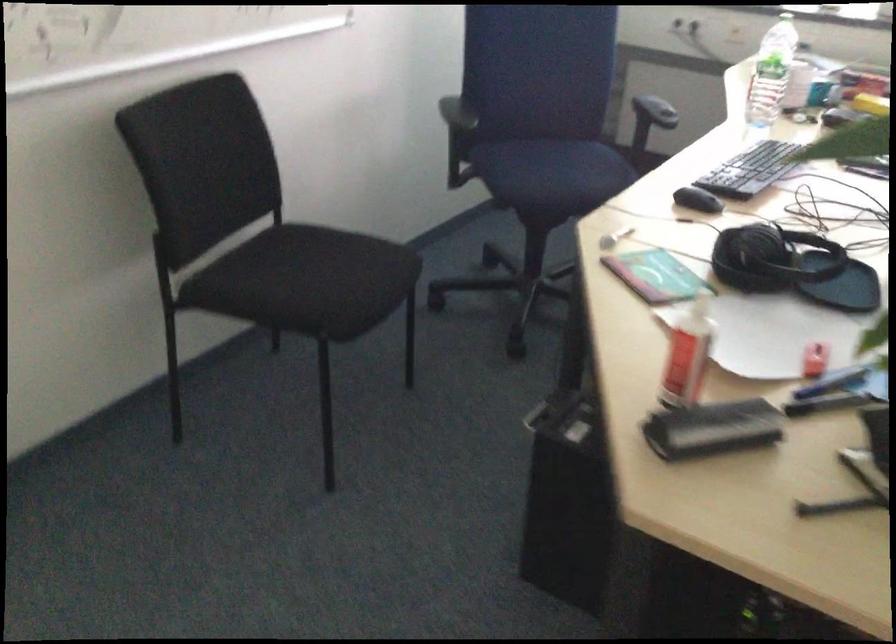
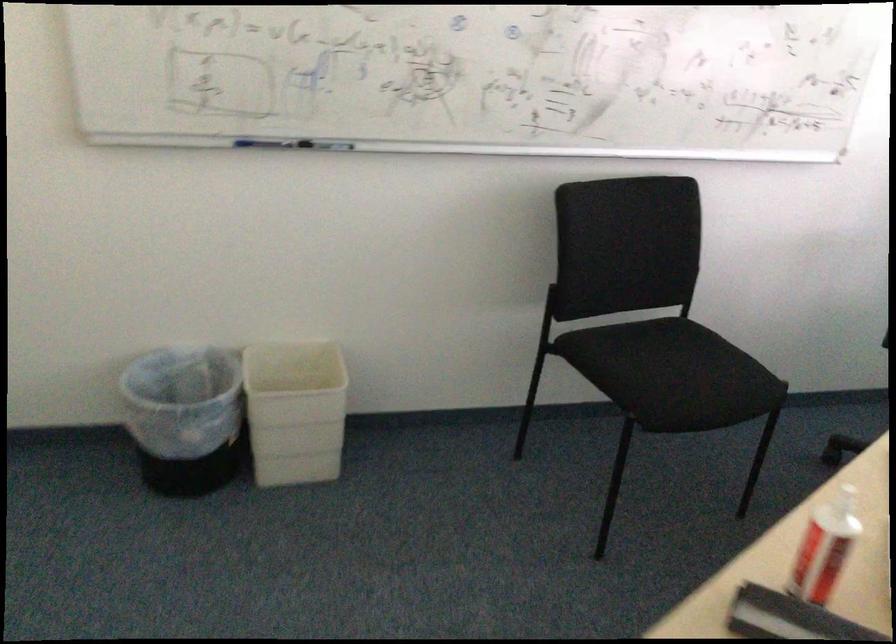
Question: The camera is either moving clockwise (left) or counter-clockwise (right) around the object. The first image is from the beginning of the video and the second image is from the end. Is the camera moving left or right when shooting the video?

Choices:
 (A) Left
 (B) Right

Answer: (B)